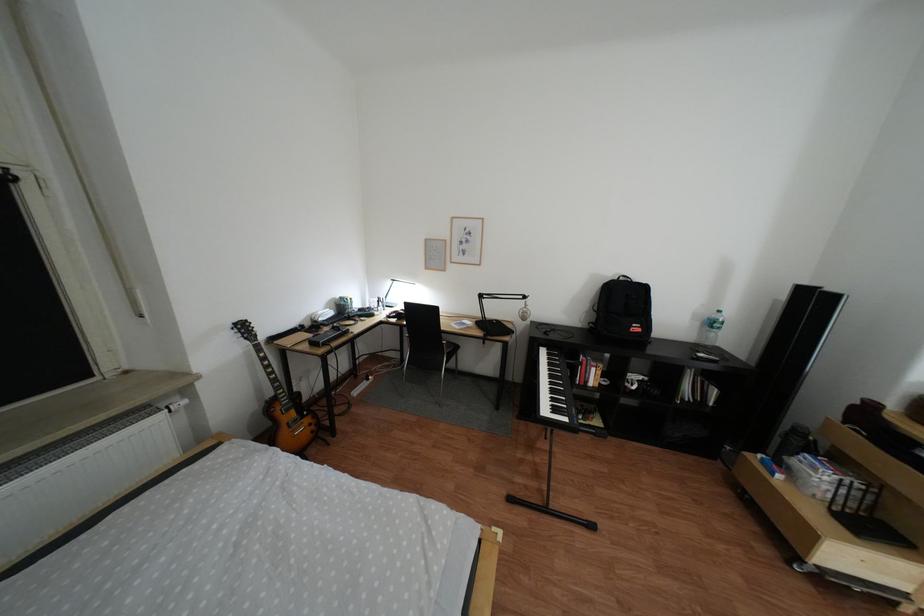
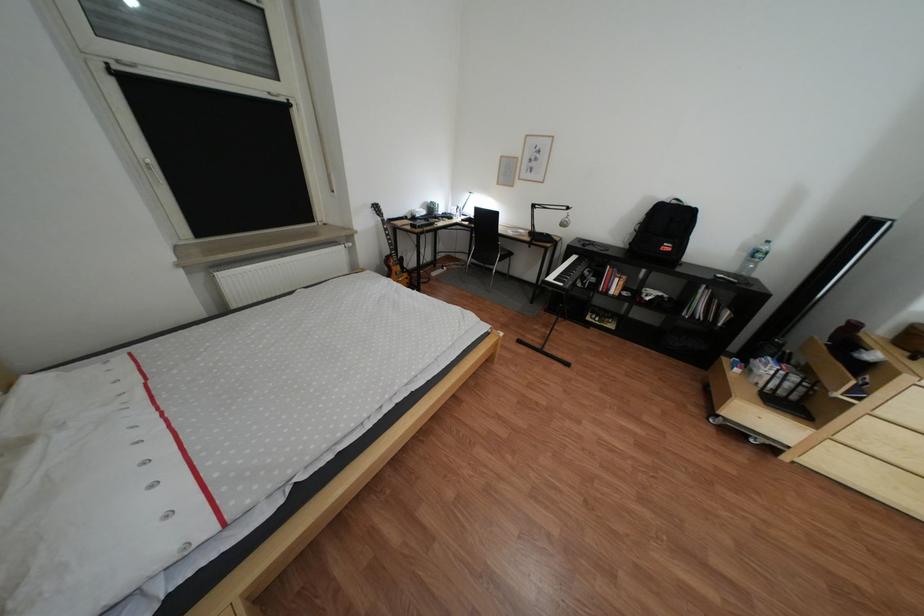
Which direction would the cameraman need to move to produce the second image?

The cameraman moved toward right, backward.